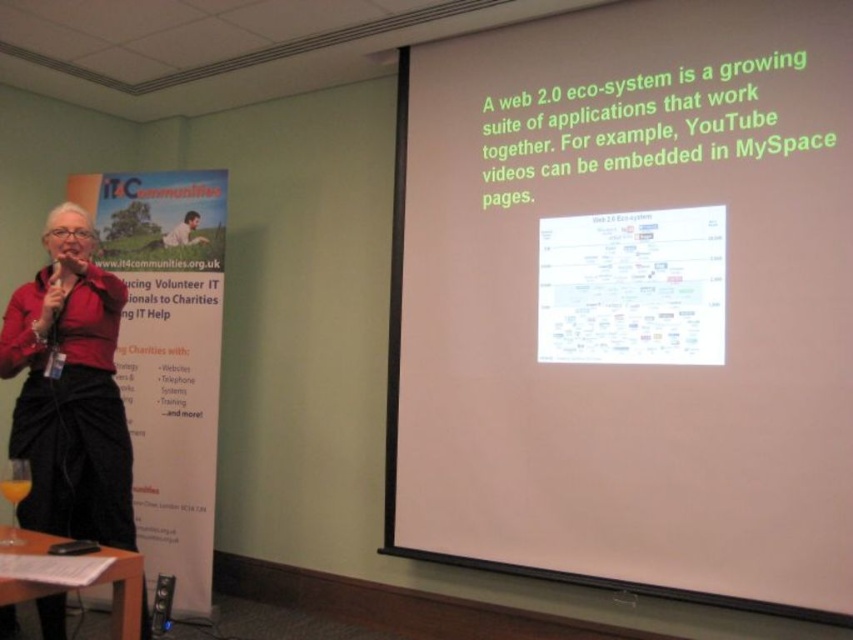
Question: In this image, where is white matte projection screen at center located relative to velvet-like black skirt at left?

Choices:
 (A) below
 (B) above

Answer: (B)

Question: Among these points, which one is farthest from the camera?

Choices:
 (A) (38, 337)
 (B) (646, 177)

Answer: (B)

Question: Does white matte projection screen at center come behind velvet-like black skirt at left?

Choices:
 (A) yes
 (B) no

Answer: (B)

Question: Is white matte projection screen at center bigger than velvet-like black skirt at left?

Choices:
 (A) yes
 (B) no

Answer: (A)

Question: Which point appears farthest from the camera in this image?

Choices:
 (A) (531, 61)
 (B) (7, 332)

Answer: (A)